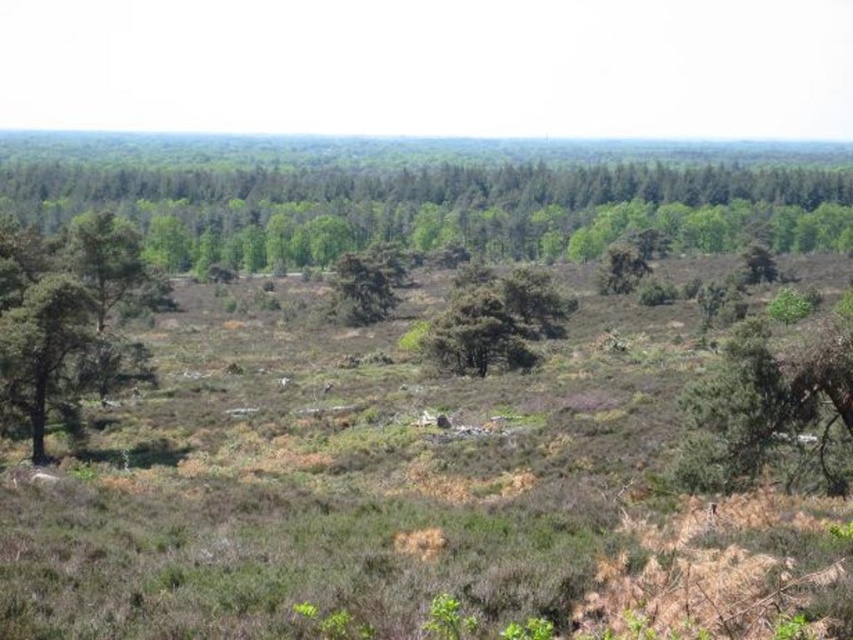
You are standing at the center of the heathland and want to locate the green leafy tree at center. Which direction should you look to find it?

The green leafy tree at center is located at point coordinates of (495, 321), so you should look directly ahead since it is at the center of the scene.

Based on the photo, you are standing at the edge of the heathland and see the green leafy tree at right and the green leafy tree at center. Which tree is positioned lower in the image?

The green leafy tree at right is located below the green leafy tree at center, so it is positioned lower in the image.

You are standing in the heathland and want to walk towards the green leafy tree at center. Which direction should you move relative to the green rough bark tree at left?

You should move to the right of the green rough bark tree at left to reach the green leafy tree at center because the green rough bark tree at left is positioned to the left of the green leafy tree at center.